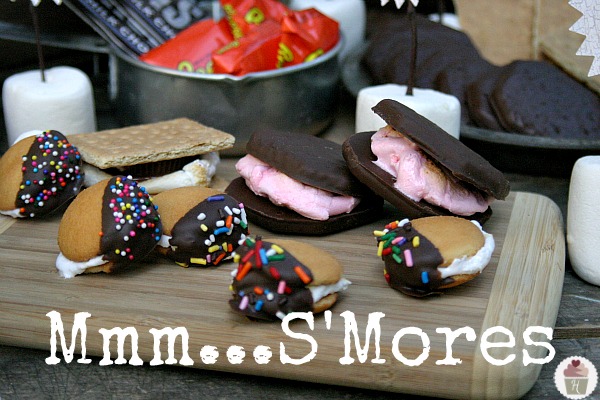
Locate an element on the screen. This screenshot has height=400, width=600. wooden cutting board is located at coordinates (523, 283).